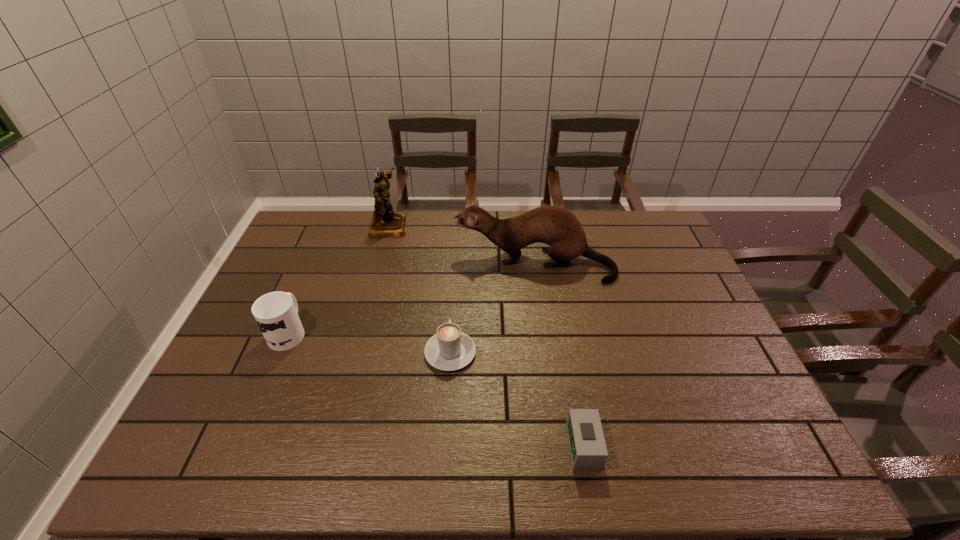
Find the location of a particular element. The height and width of the screenshot is (540, 960). vacant region between the tallest object and the leftmost object is located at coordinates (338, 279).

Locate an element on the screen. This screenshot has height=540, width=960. vacant space that's between the nearest object and the leftmost object is located at coordinates (436, 389).

This screenshot has width=960, height=540. Find the location of `unoccupied position between the leftmost object and the cappuccino`. unoccupied position between the leftmost object and the cappuccino is located at coordinates (369, 342).

What are the coordinates of `object that is the second closest one to the ferret` in the screenshot? It's located at (450, 349).

Locate which object is the closest to the alarm clock. Please provide its 2D coordinates. Your answer should be formatted as a tuple, i.e. [(x, y)], where the tuple contains the x and y coordinates of a point satisfying the conditions above.

[(450, 349)]

In order to click on blank space that satisfies the following two spatial constraints: 1. to the right of the fourth tallest object; 2. on the front-facing side of the tallest object in this screenshot , I will do coord(458,226).

Locate an element on the screen. The width and height of the screenshot is (960, 540). free spot that satisfies the following two spatial constraints: 1. on the front-facing side of the fourth object from right to left; 2. to the right of the cappuccino is located at coordinates (355, 353).